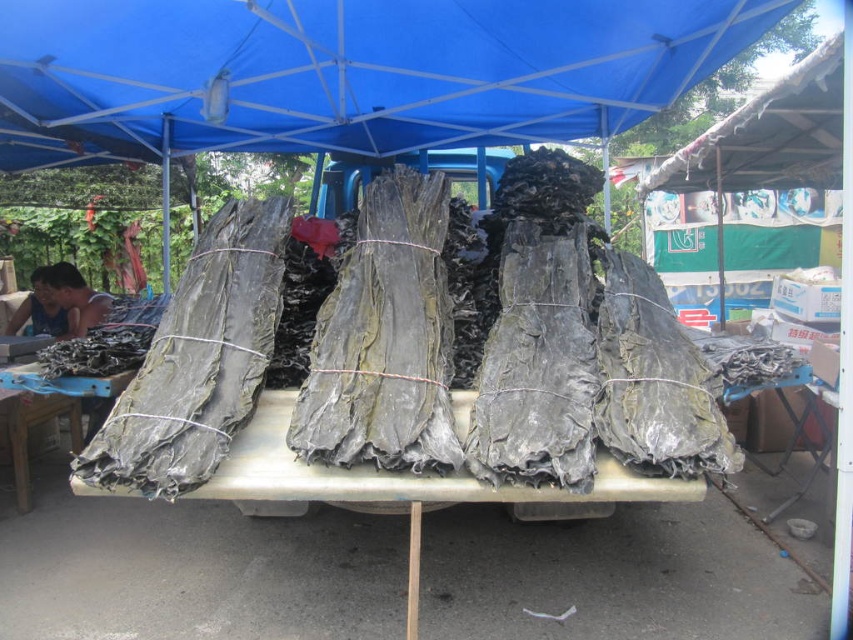
Question: Estimate the real-world distances between objects in this image. Which object is farther from the green leafy bundles at center?

Choices:
 (A) matte black fabric at left
 (B) blue fabric vendor at left
 (C) rough wooden table at lower left

Answer: (A)

Question: Can you confirm if blue fabric vendor at left is positioned to the right of matte black fabric at left?

Choices:
 (A) no
 (B) yes

Answer: (B)

Question: Which point is farther to the camera?

Choices:
 (A) green leafy bundles at center
 (B) rough wooden table at lower left
 (C) blue fabric vendor at left
 (D) matte black fabric at left

Answer: (D)

Question: Is blue fabric canopy at upper center positioned behind blue fabric vendor at left?

Choices:
 (A) no
 (B) yes

Answer: (A)

Question: Observing the image, what is the correct spatial positioning of green leafy bundles at center in reference to matte black fabric at left?

Choices:
 (A) left
 (B) right

Answer: (B)

Question: Estimate the real-world distances between objects in this image. Which object is farther from the rough wooden table at lower left?

Choices:
 (A) blue fabric vendor at left
 (B) green leafy bundles at center
 (C) blue fabric canopy at upper center
 (D) matte black fabric at left

Answer: (C)